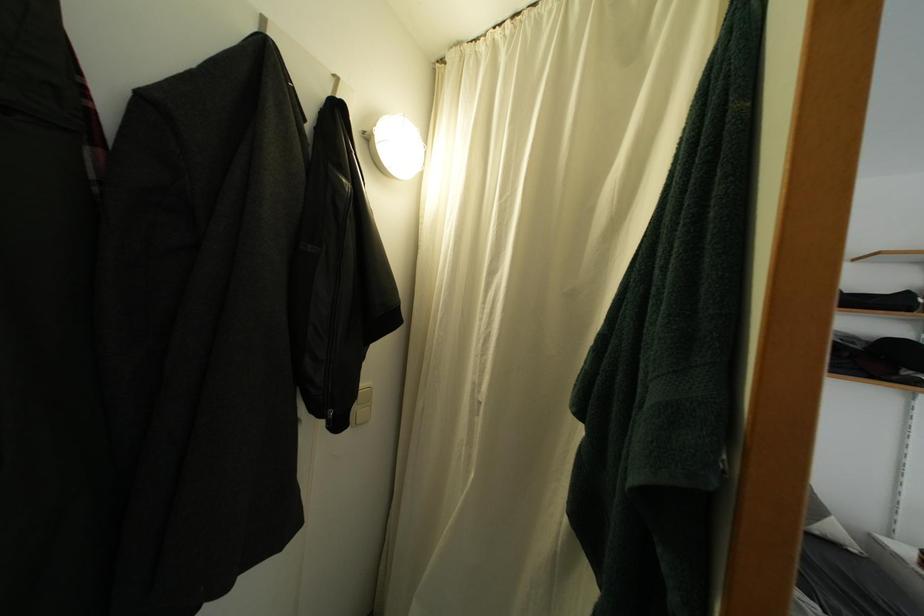
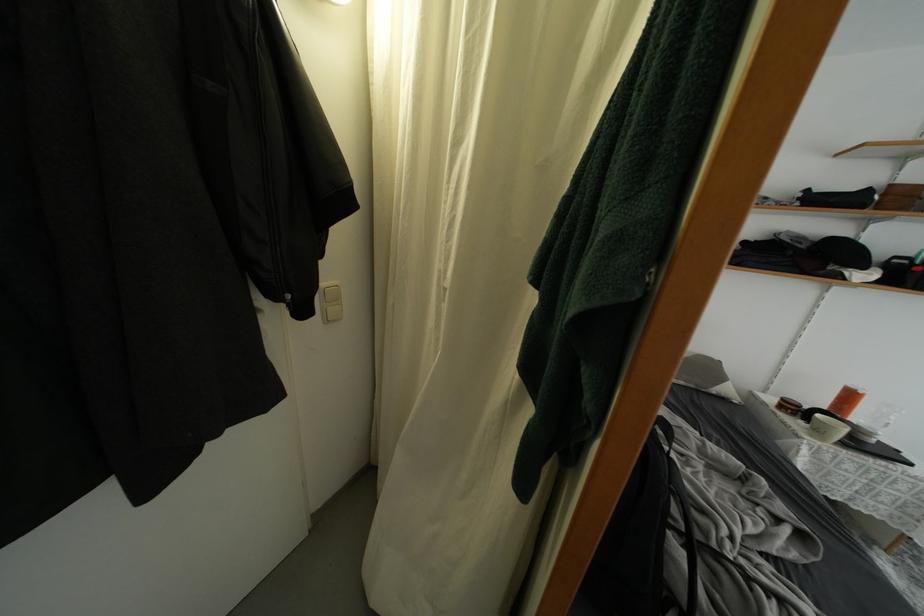
Find the pixel in the second image that matches [346,427] in the first image.

(310, 315)